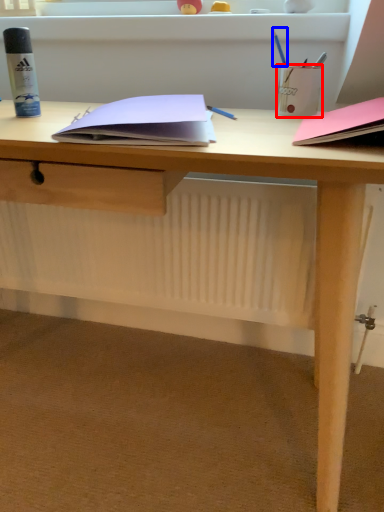
Question: Which object is closer to the camera taking this photo, stationery (highlighted by a red box) or stationery (highlighted by a blue box)?

Choices:
 (A) stationery
 (B) stationery

Answer: (A)